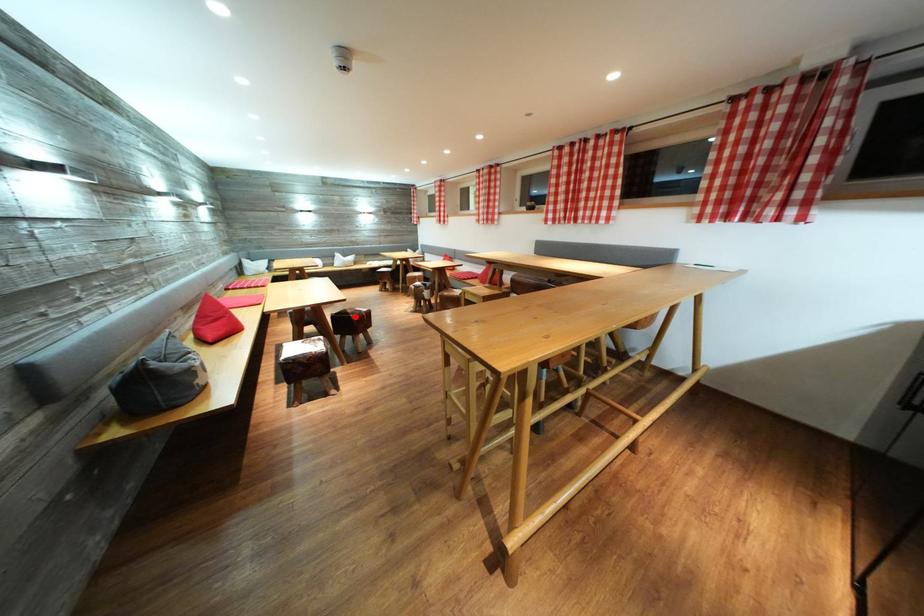
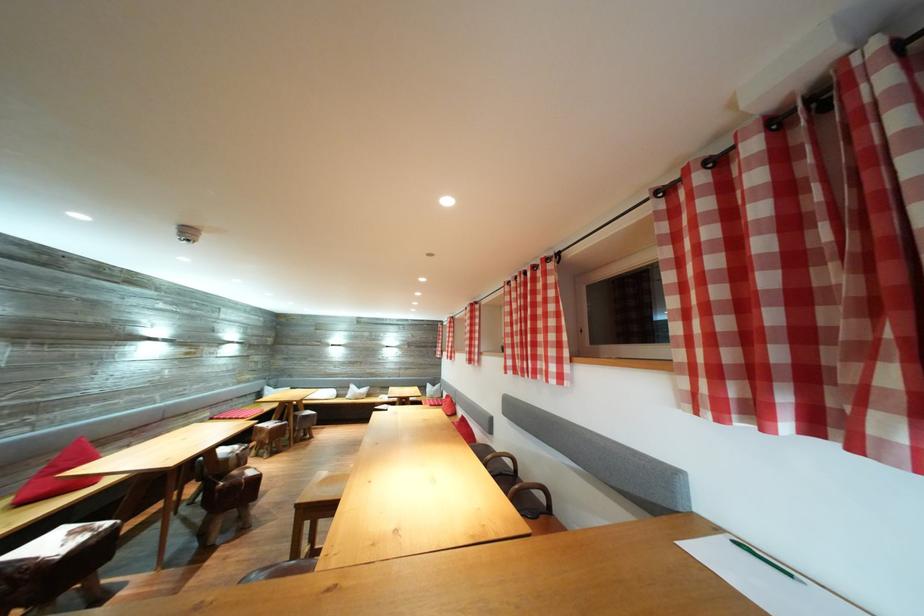
Question: A red point is marked in image1. In image2, is the corresponding 3D point closer to the camera or farther? Reply with the corresponding letter.

Choices:
 (A) The corresponding 3D point is closer.
 (B) The corresponding 3D point is farther.

Answer: (B)